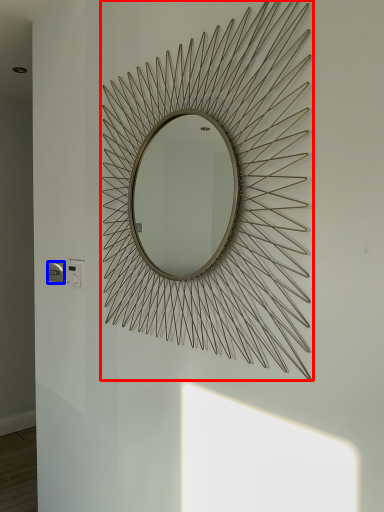
Question: Which of the following is the farthest to the observer, mirror (highlighted by a red box) or electric outlet (highlighted by a blue box)?

Choices:
 (A) mirror
 (B) electric outlet

Answer: (B)